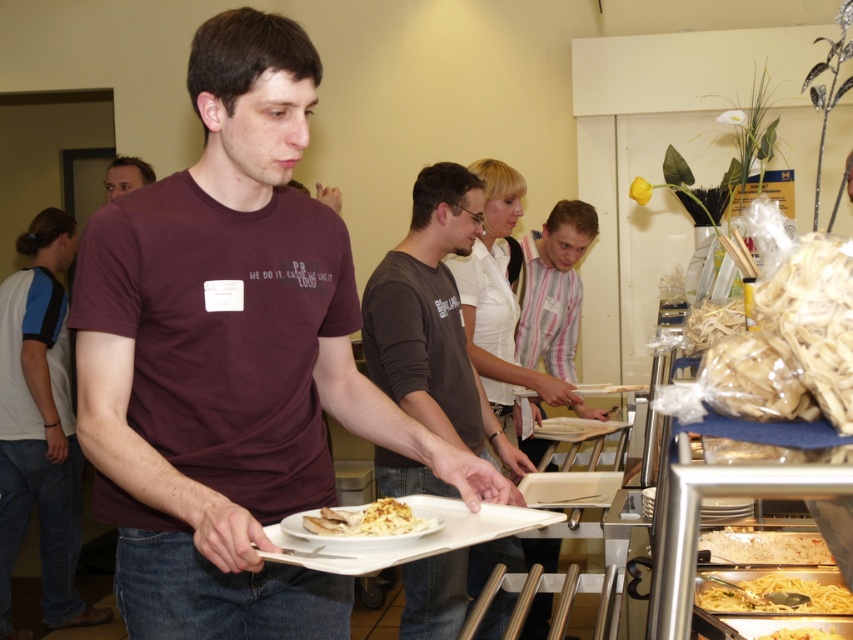
Question: Can you confirm if light brown wooden skewers at right is positioned below white creamy pasta at lower right?

Choices:
 (A) yes
 (B) no

Answer: (B)

Question: Does light brown wooden skewers at right appear over yellowish matte spaghetti at lower right?

Choices:
 (A) no
 (B) yes

Answer: (B)

Question: Which of the following is the closest to the observer?

Choices:
 (A) (776, 582)
 (B) (163, 456)
 (C) (770, 632)
 (D) (457, 321)

Answer: (C)

Question: Which of the following is the closest to the observer?

Choices:
 (A) yellowish matte spaghetti at lower right
 (B) light brown wooden skewers at right
 (C) white glossy plate at center
 (D) white creamy pasta at lower right

Answer: (B)

Question: Which point is farther to the camera?

Choices:
 (A) (792, 540)
 (B) (811, 284)
 (C) (263, 147)

Answer: (A)

Question: Does maroon t-shirt at center appear over yellowish matte spaghetti at lower right?

Choices:
 (A) yes
 (B) no

Answer: (A)